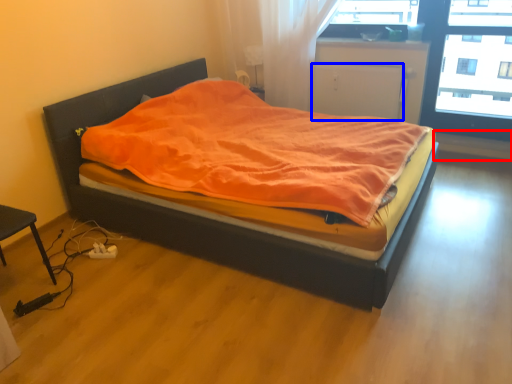
Question: Which object appears farthest to the camera in this image, window sill (highlighted by a red box) or screen door (highlighted by a blue box)?

Choices:
 (A) window sill
 (B) screen door

Answer: (A)